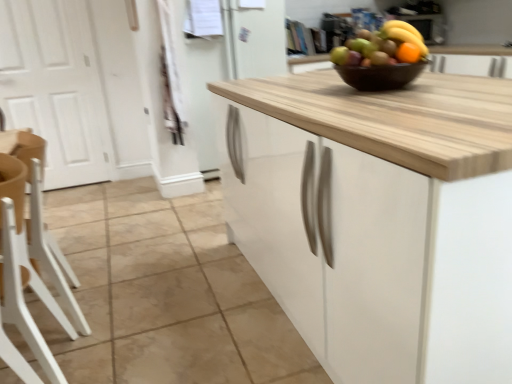
At what (x,y) coordinates should I click in order to perform the action: click on free region under white wood chair at left, which is the 2th chair from front to back (from a real-world perspective). Please return your answer as a coordinate pair (x, y). Looking at the image, I should click on (44, 319).